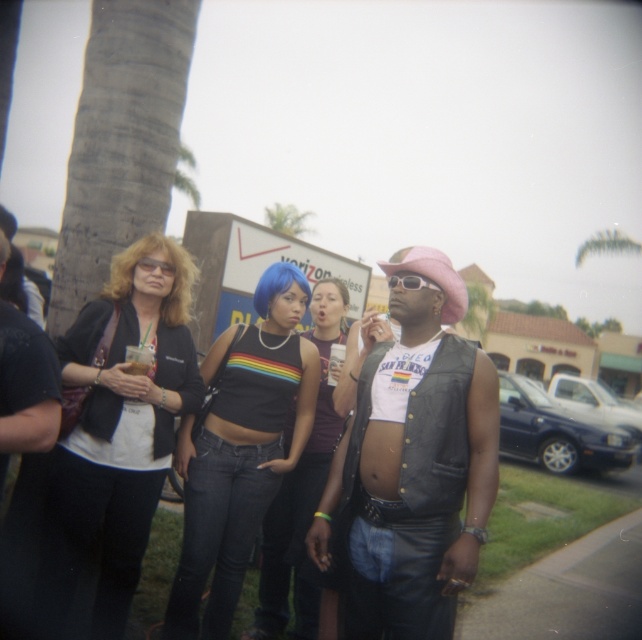
Question: Estimate the real-world distances between objects in this image. Which object is closer to the green leafy palm tree at upper center?

Choices:
 (A) clear plastic cup at center
 (B) rainbow fabric crop top at center
 (C) leather vest at center

Answer: (B)

Question: Does clear plastic cup at center appear on the left side of matte black glasses at upper center?

Choices:
 (A) no
 (B) yes

Answer: (A)

Question: Which point is closer to the camera?

Choices:
 (A) clear plastic cup at center
 (B) rainbow fabric crop top at center
 (C) sunglasses at center

Answer: (C)

Question: Can you confirm if matte black jacket at left is thinner than clear plastic cup at center?

Choices:
 (A) no
 (B) yes

Answer: (A)

Question: Which of the following is the farthest from the observer?

Choices:
 (A) (153, 259)
 (B) (273, 483)

Answer: (B)

Question: Does leather vest at center appear under sunglasses at center?

Choices:
 (A) no
 (B) yes

Answer: (B)